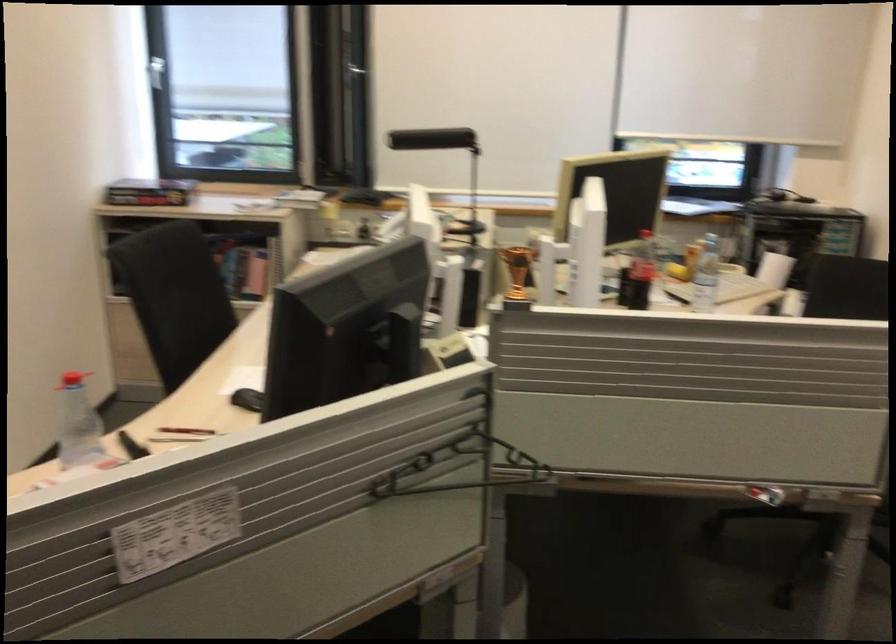
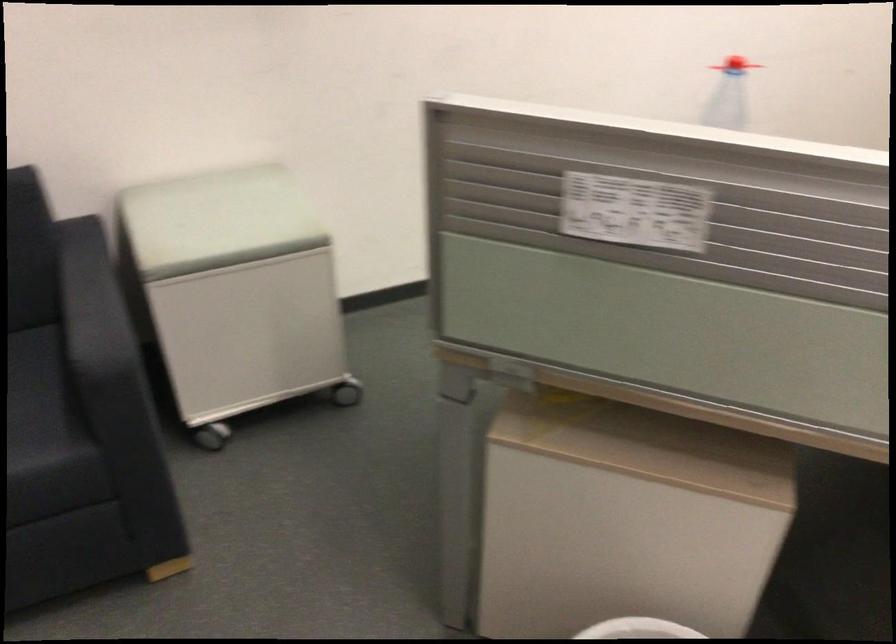
Based on the continuous images, in which direction is the camera rotating?

The camera's rotation is toward left-down.